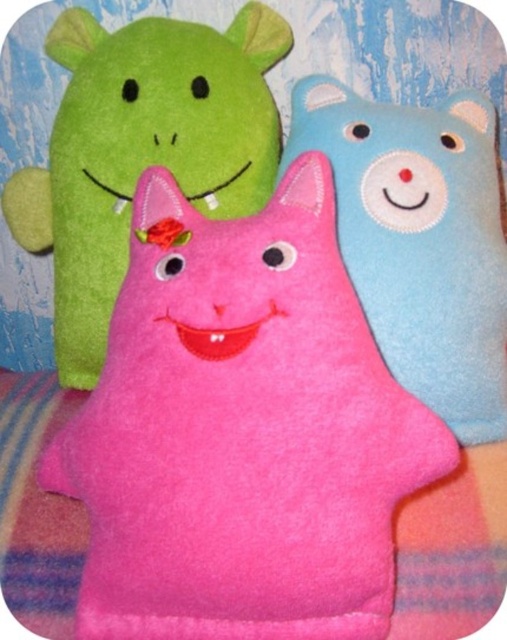
Does pink felt cat at center come behind blue felt bear at upper right?

No.

The height and width of the screenshot is (640, 507). I want to click on pink felt cat at center, so click(241, 432).

Measure the distance from matte pink plush at center to blue felt bear at upper right.

A distance of 23.22 centimeters exists between matte pink plush at center and blue felt bear at upper right.

Does point (27, 198) come behind point (359, 132)?

Yes, point (27, 198) is farther from viewer.

Where is `matte pink plush at center`? This screenshot has width=507, height=640. matte pink plush at center is located at coordinates [x=141, y=150].

Does pink felt cat at center have a greater width compared to matte pink plush at center?

Yes, pink felt cat at center is wider than matte pink plush at center.

Who is shorter, pink felt cat at center or matte pink plush at center?

pink felt cat at center is shorter.

This screenshot has width=507, height=640. What do you see at coordinates (241, 432) in the screenshot? I see `pink felt cat at center` at bounding box center [241, 432].

This screenshot has height=640, width=507. I want to click on pink felt cat at center, so click(241, 432).